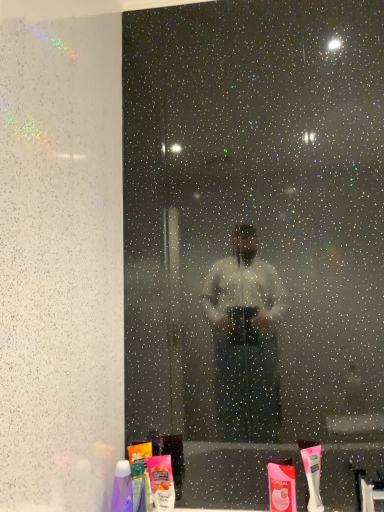
Question: Does matte pink plastic toothpaste at lower center, which is the 3th toiletry from left to right, lie behind pink matte lotion at lower center, which is counted as the second toiletry, starting from the right?

Choices:
 (A) no
 (B) yes

Answer: (B)

Question: Considering the relative sizes of matte pink plastic toothpaste at lower center, arranged as the first toiletry when viewed from the right, and pink matte lotion at lower center, which is counted as the second toiletry, starting from the right, in the image provided, is matte pink plastic toothpaste at lower center, arranged as the first toiletry when viewed from the right, taller than pink matte lotion at lower center, which is counted as the second toiletry, starting from the right,?

Choices:
 (A) no
 (B) yes

Answer: (A)

Question: Is matte pink plastic toothpaste at lower center, which is the 3th toiletry from left to right, in front of pink matte lotion at lower center, marked as the second toiletry in a left-to-right arrangement?

Choices:
 (A) no
 (B) yes

Answer: (A)

Question: Is matte pink plastic toothpaste at lower center, arranged as the first toiletry when viewed from the right, located outside pink matte lotion at lower center, marked as the second toiletry in a left-to-right arrangement?

Choices:
 (A) no
 (B) yes

Answer: (B)

Question: From a real-world perspective, is matte pink plastic toothpaste at lower center, which is the 3th toiletry from left to right, located beneath pink matte lotion at lower center, marked as the second toiletry in a left-to-right arrangement?

Choices:
 (A) no
 (B) yes

Answer: (B)

Question: In terms of height, does pink matte lotion at lower center, which is counted as the second toiletry, starting from the right, look taller or shorter compared to white plastic toothbrush at lower right?

Choices:
 (A) tall
 (B) short

Answer: (B)

Question: From a real-world perspective, relative to white plastic toothbrush at lower right, is pink matte lotion at lower center, which is counted as the second toiletry, starting from the right, vertically above or below?

Choices:
 (A) below
 (B) above

Answer: (A)

Question: Looking at the image, does pink matte lotion at lower center, which is counted as the second toiletry, starting from the right, seem bigger or smaller compared to white plastic toothbrush at lower right?

Choices:
 (A) big
 (B) small

Answer: (B)

Question: Is point (155, 508) closer or farther from the camera than point (314, 510)?

Choices:
 (A) farther
 (B) closer

Answer: (B)

Question: In terms of width, does translucent plastic mouthwash at lower center look wider or thinner when compared to white plastic toothbrush at lower right?

Choices:
 (A) thin
 (B) wide

Answer: (B)

Question: In the image, is translucent plastic mouthwash at lower center positioned in front of or behind white plastic toothbrush at lower right?

Choices:
 (A) front
 (B) behind

Answer: (B)

Question: From the image's perspective, is translucent plastic mouthwash at lower center positioned above or below white plastic toothbrush at lower right?

Choices:
 (A) above
 (B) below

Answer: (B)

Question: Is translucent plastic mouthwash at lower center to the left or to the right of white plastic toothbrush at lower right in the image?

Choices:
 (A) left
 (B) right

Answer: (A)

Question: Relative to pink matte lotion at lower center, which is counted as the second toiletry, starting from the right, is white plastic toothbrush at lower right in front or behind?

Choices:
 (A) behind
 (B) front

Answer: (B)

Question: Which is correct: white plastic toothbrush at lower right is inside pink matte lotion at lower center, marked as the second toiletry in a left-to-right arrangement, or outside of it?

Choices:
 (A) outside
 (B) inside

Answer: (A)